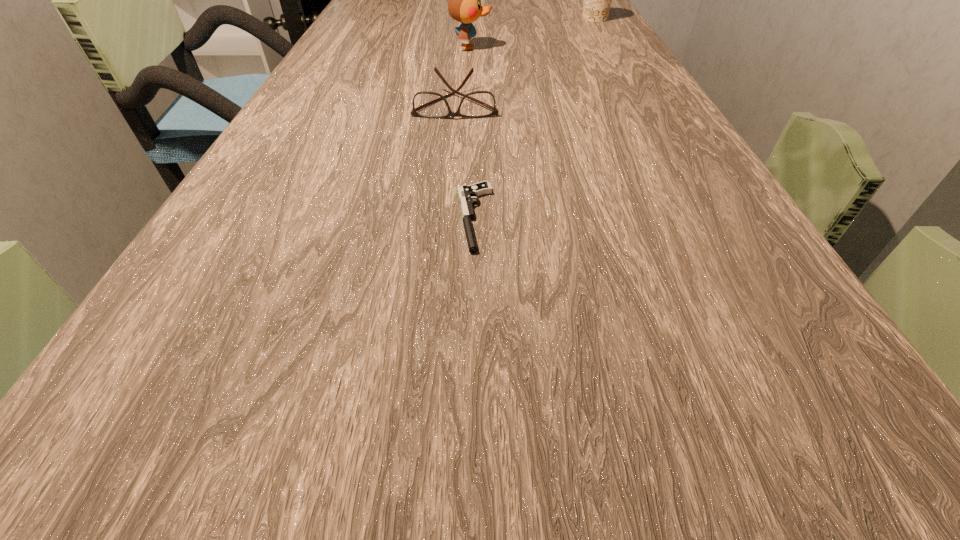
Where is `free space that satisfies the following two spatial constraints: 1. on the front-facing side of the tallest object; 2. on the front-facing side of the spectacles`? free space that satisfies the following two spatial constraints: 1. on the front-facing side of the tallest object; 2. on the front-facing side of the spectacles is located at coordinates (468, 103).